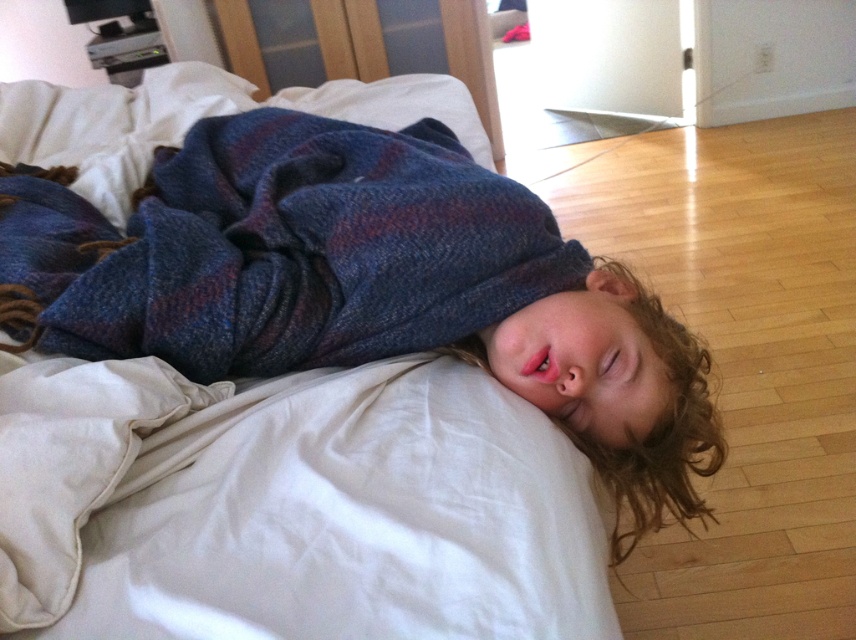
In the scene shown: Is blue woolen blanket at center positioned behind plaid wool blanket at center?

No, it is not.

How distant is blue woolen blanket at center from plaid wool blanket at center?

blue woolen blanket at center is 1.03 inches away from plaid wool blanket at center.

Does point (528, 356) lie in front of point (407, 305)?

Yes, point (528, 356) is closer to viewer.

You are a GUI agent. You are given a task and a screenshot of the screen. Output one action in this format:
    pyautogui.click(x=<x>, y=<y>)
    Task: Click on the blue woolen blanket at center
    The image size is (856, 640).
    Given the screenshot: What is the action you would take?
    pyautogui.click(x=363, y=284)